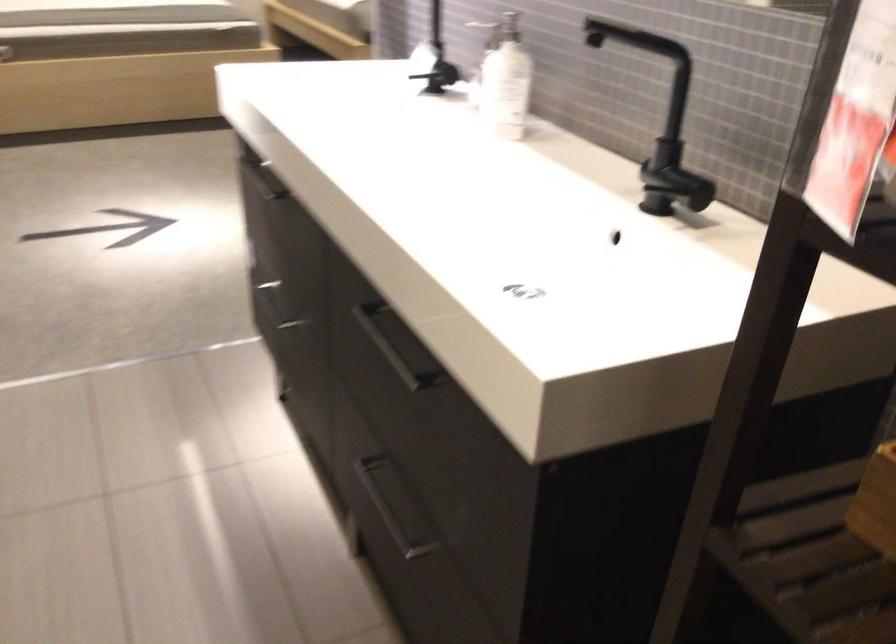
What are the coordinates of `soap dispenser pump` in the screenshot? It's located at (503, 8).